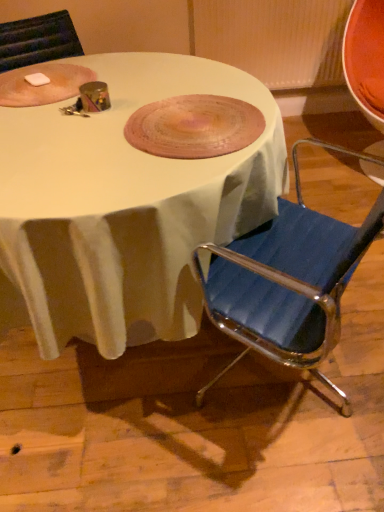
Where is `white glossy table at center`? This screenshot has height=512, width=384. white glossy table at center is located at coordinates (123, 208).

Describe the element at coordinates (123, 208) in the screenshot. This screenshot has width=384, height=512. I see `white glossy table at center` at that location.

The image size is (384, 512). Identify the location of white glossy table at center. (123, 208).